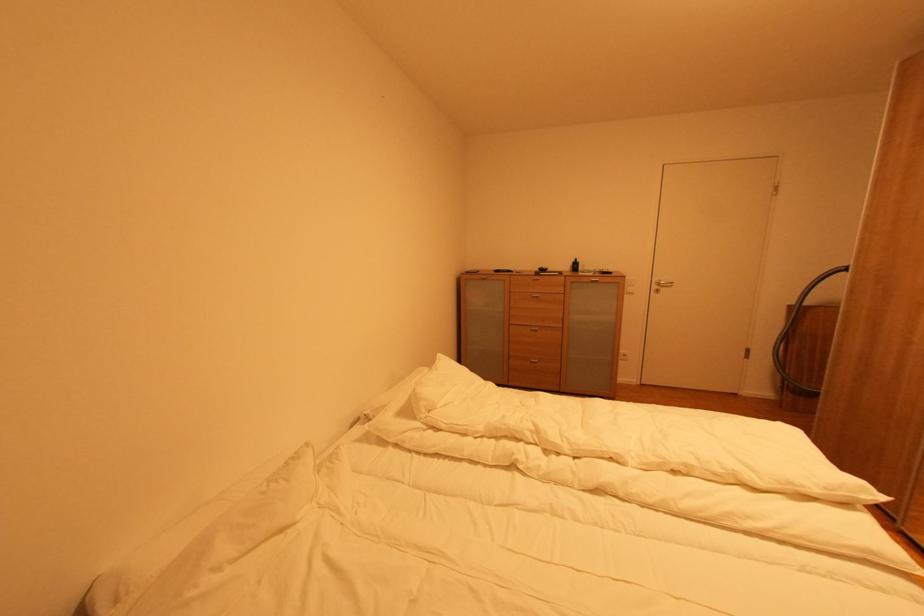
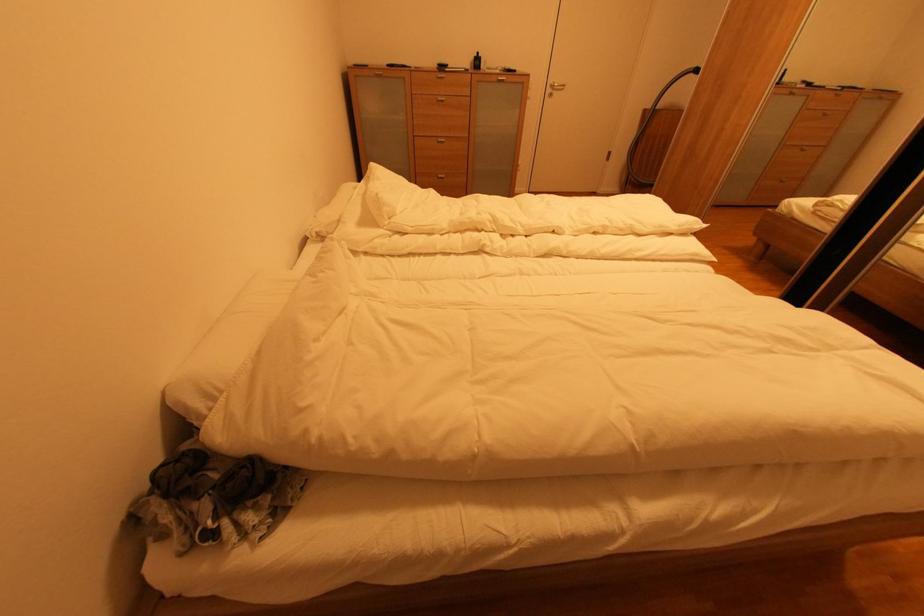
The first image is from the beginning of the video and the second image is from the end. How did the camera likely rotate when shooting the video?

The camera's rotation is toward right-down.